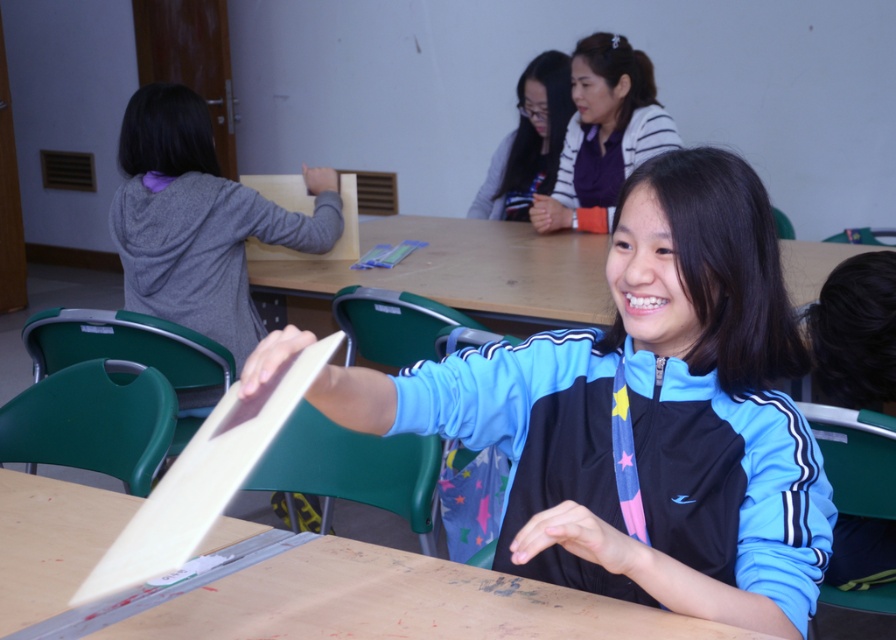
What object is located at the coordinate point (602, 134) in the image?

The point (602, 134) indicates the location of the matte purple sweater at upper center.